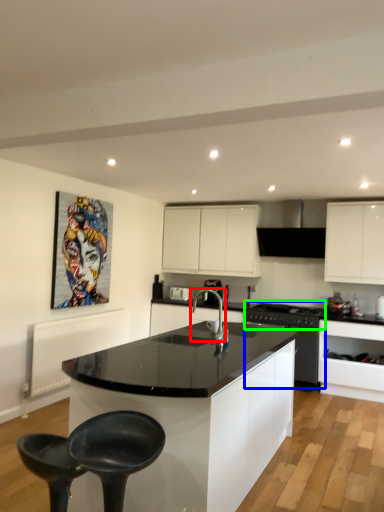
Question: Which object is positioned farthest from tap (highlighted by a red box)? Select from kitchen appliance (highlighted by a blue box) and stove (highlighted by a green box).

Choices:
 (A) kitchen appliance
 (B) stove

Answer: (A)